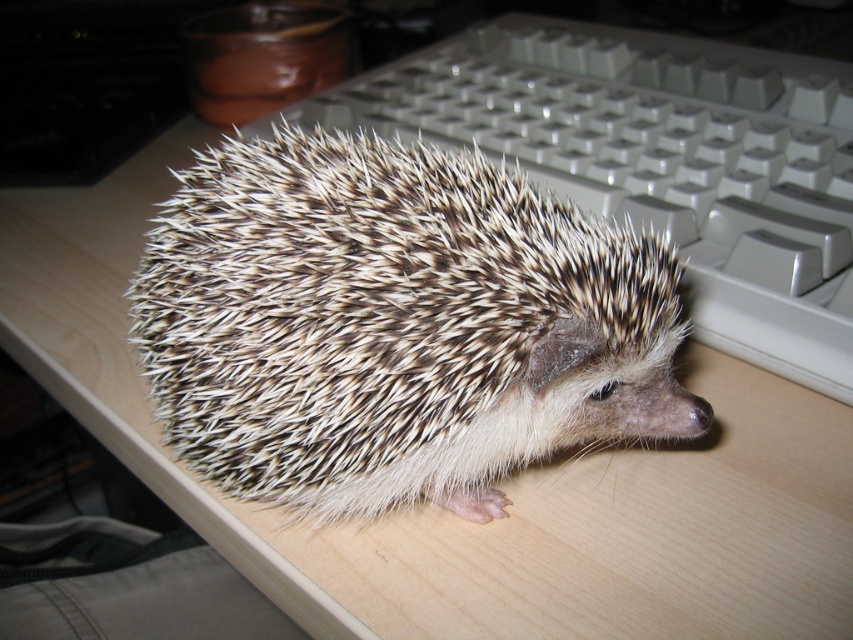
Who is higher up, spiky brown hedgehog at center or white plastic keyboard at upper right?

white plastic keyboard at upper right is higher up.

Is spiky brown hedgehog at center taller than white plastic keyboard at upper right?

Incorrect, spiky brown hedgehog at center's height is not larger of white plastic keyboard at upper right's.

Is point (228, 220) farther from viewer compared to point (822, 198)?

No, (228, 220) is in front of (822, 198).

The width and height of the screenshot is (853, 640). What are the coordinates of `spiky brown hedgehog at center` in the screenshot? It's located at (395, 324).